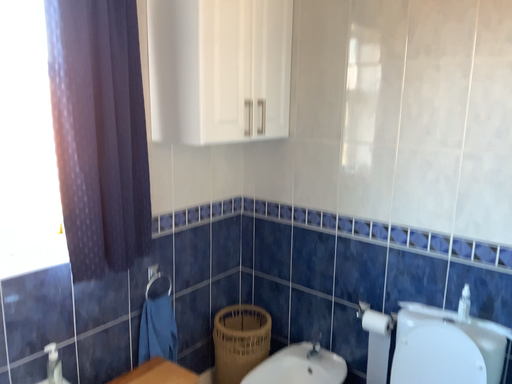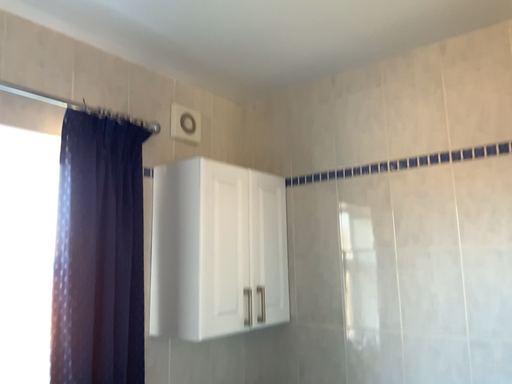
Question: How did the camera likely rotate when shooting the video?

Choices:
 (A) rotated upward
 (B) rotated downward

Answer: (A)